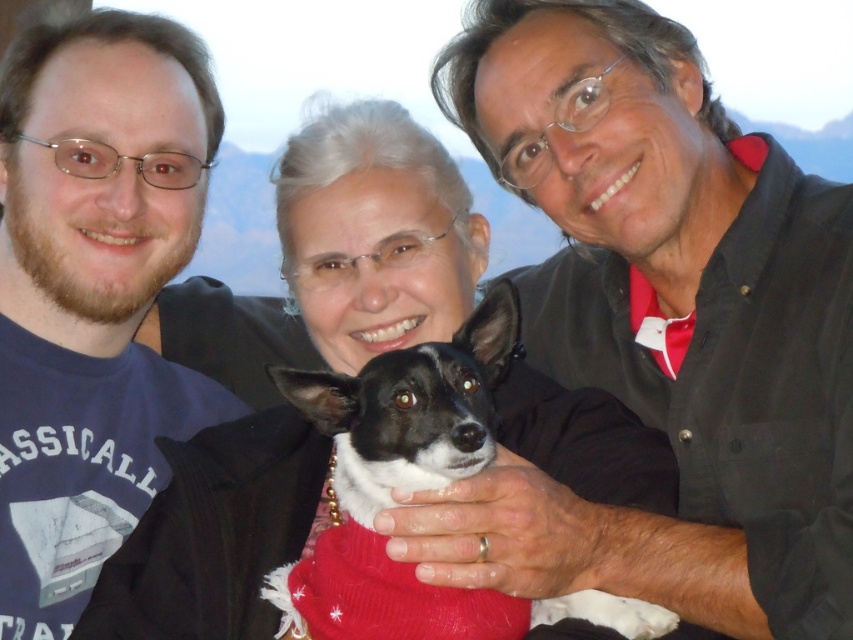
Identify the location of black matte shirt at center. Image resolution: width=853 pixels, height=640 pixels. (680, 275).

Can you confirm if black matte shirt at center is thinner than matte blue shirt at left?

No.

Which is in front, point (807, 278) or point (112, 456)?

Point (807, 278) is in front.

Find the location of a particular element. The width and height of the screenshot is (853, 640). black matte shirt at center is located at coordinates (680, 275).

Is black matte shirt at center to the right of black and white fur at center from the viewer's perspective?

Indeed, black matte shirt at center is positioned on the right side of black and white fur at center.

Measure the distance between point (773, 480) and camera.

Point (773, 480) and camera are 5.19 feet apart.

Identify the location of black matte shirt at center. (680, 275).

Describe the element at coordinates (91, 292) in the screenshot. I see `matte blue shirt at left` at that location.

Does point (79, 556) lie behind point (431, 611)?

Yes, it is behind point (431, 611).

Is point (100, 13) positioned after point (451, 401)?

Yes, point (100, 13) is farther from viewer.

Where is `matte blue shirt at left`? matte blue shirt at left is located at coordinates (91, 292).